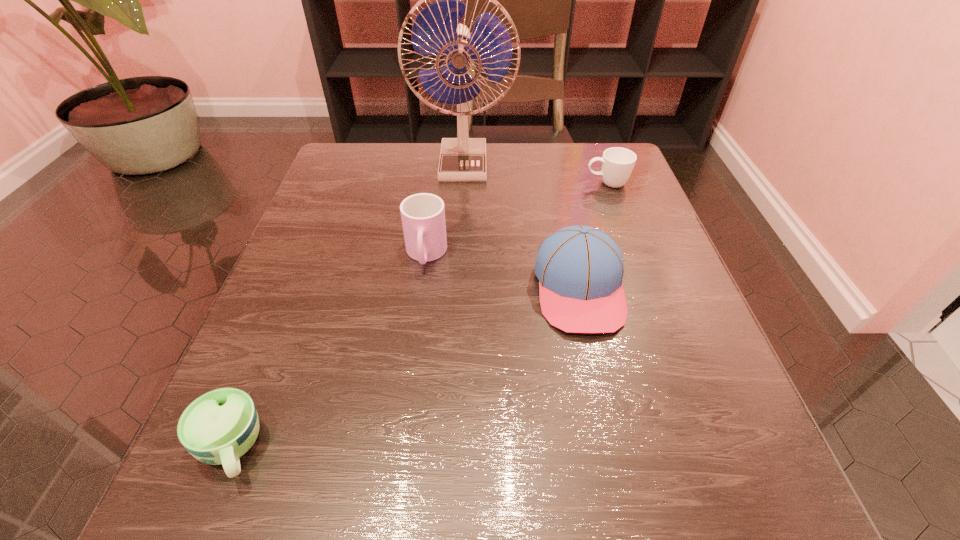
Locate an element on the screen. This screenshot has height=540, width=960. object that is at the near left corner is located at coordinates (220, 426).

The height and width of the screenshot is (540, 960). Identify the location of object at the far right corner. (617, 163).

Find the location of a particular element. This screenshot has width=960, height=540. vacant space at the far edge of the desktop is located at coordinates (521, 144).

At what (x,y) coordinates should I click in order to perform the action: click on vacant space at the near edge of the desktop. Please return your answer as a coordinate pair (x, y). Looking at the image, I should click on (420, 489).

This screenshot has width=960, height=540. In the image, there is a desktop. Identify the location of vacant space at the left edge. (350, 320).

Where is `blank space at the right edge of the desktop`? The height and width of the screenshot is (540, 960). blank space at the right edge of the desktop is located at coordinates (660, 370).

The height and width of the screenshot is (540, 960). Identify the location of free space at the far left corner. (327, 174).

At what (x,y) coordinates should I click in order to perform the action: click on vacant space at the near right corner. Please return your answer as a coordinate pair (x, y). The height and width of the screenshot is (540, 960). Looking at the image, I should click on (696, 498).

Where is `empty location between the baseball cap and the nearest cup`? This screenshot has width=960, height=540. empty location between the baseball cap and the nearest cup is located at coordinates (405, 368).

Identify the location of empty space that is in between the rightmost cup and the fan. (536, 174).